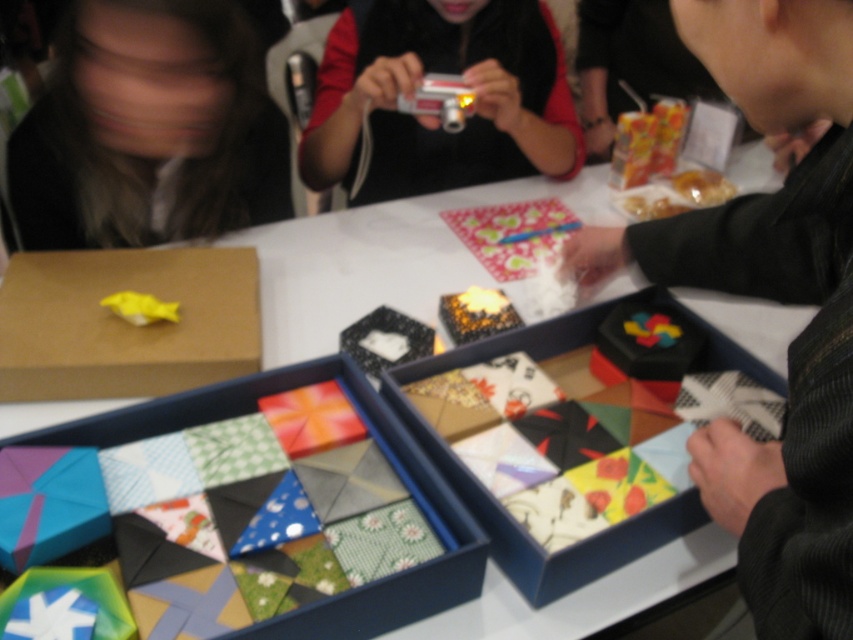
Who is positioned more to the right, brown cardboard box at center-left or colorful paper puzzle pieces at center?

From the viewer's perspective, colorful paper puzzle pieces at center appears more on the right side.

Where is `brown cardboard box at center-left`? The height and width of the screenshot is (640, 853). brown cardboard box at center-left is located at coordinates (125, 323).

The height and width of the screenshot is (640, 853). Identify the location of brown cardboard box at center-left. (125, 323).

Is colorful paper box at center to the left of colorful paper puzzle pieces at center from the viewer's perspective?

In fact, colorful paper box at center is to the right of colorful paper puzzle pieces at center.

Can you confirm if colorful paper box at center is shorter than colorful paper puzzle pieces at center?

No.

This screenshot has height=640, width=853. I want to click on colorful paper box at center, so click(x=560, y=444).

Does silky black kimono at right appear over colorful paper box at center?

Correct, silky black kimono at right is located above colorful paper box at center.

At what (x,y) coordinates should I click in order to perform the action: click on silky black kimono at right. Please return your answer as a coordinate pair (x, y). Looking at the image, I should click on (772, 300).

I want to click on silky black kimono at right, so click(772, 300).